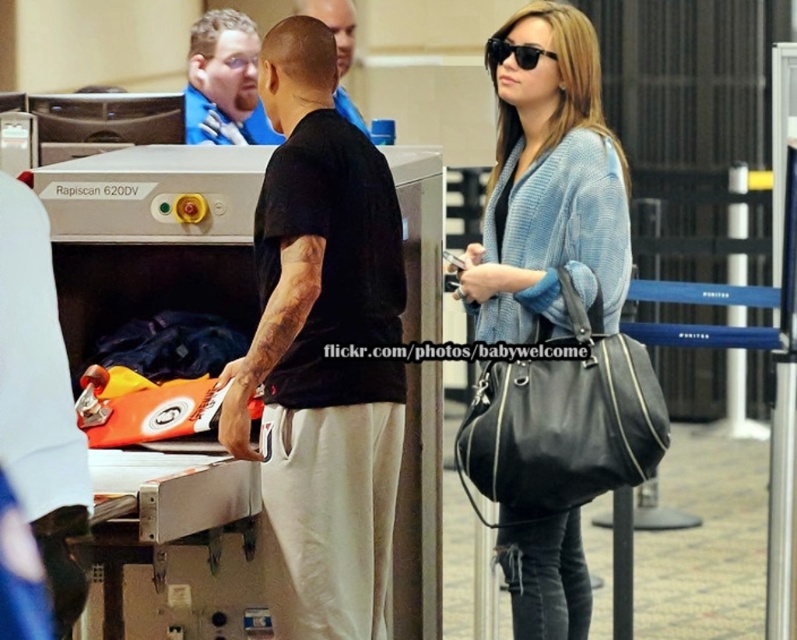
Question: Which point is farther to the camera?

Choices:
 (A) sunglasses at upper center
 (B) blue fabric shirt at upper left
 (C) shiny blue shirt at center

Answer: (C)

Question: Does blue fabric shirt at upper left appear under shiny blue shirt at center?

Choices:
 (A) yes
 (B) no

Answer: (A)

Question: Among these objects, which one is nearest to the camera?

Choices:
 (A) shiny blue shirt at center
 (B) light blue knitted sweater at center

Answer: (B)

Question: Can you confirm if blue fabric shirt at upper left is wider than shiny blue shirt at center?

Choices:
 (A) yes
 (B) no

Answer: (A)

Question: Which is nearer to the sunglasses at upper center?

Choices:
 (A) black matte t-shirt at center
 (B) light blue knitted sweater at center
 (C) shiny blue shirt at center

Answer: (B)

Question: Can you confirm if light blue knitted sweater at center is positioned to the right of sunglasses at upper center?

Choices:
 (A) yes
 (B) no

Answer: (A)